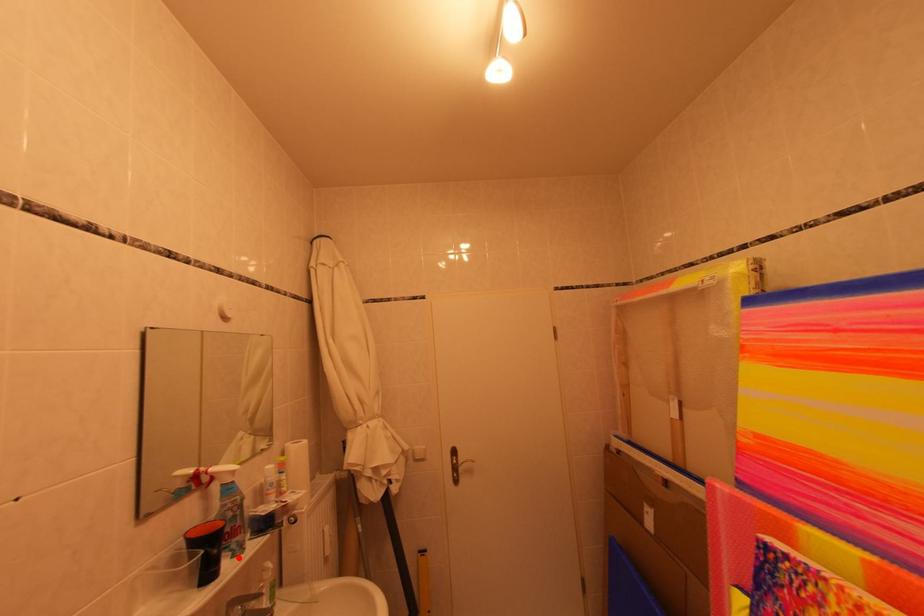
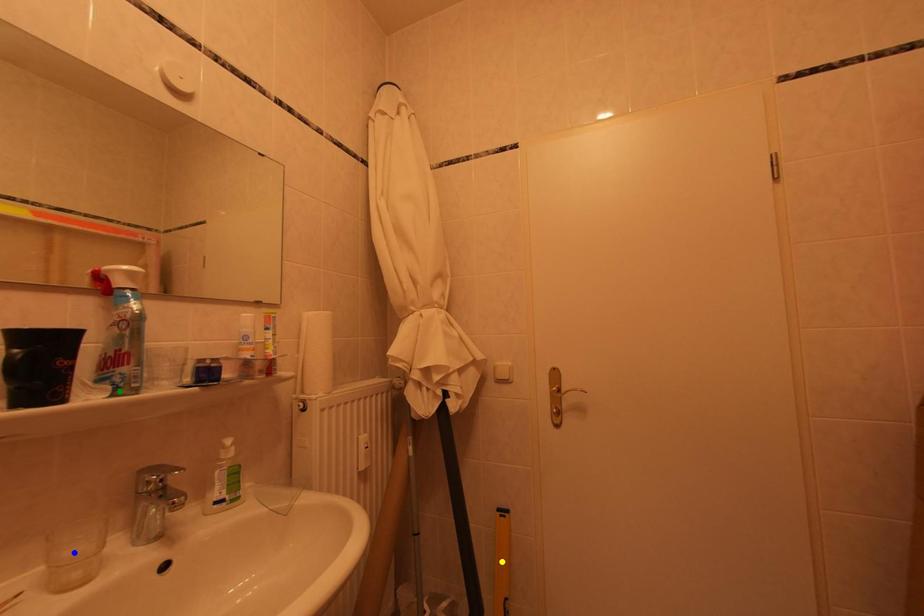
Question: I am providing you with two images of the same scene from different viewpoints. A red point is marked on the first image. You are given multiple points on the second image. Can you choose the point in image 2 that corresponds to the point in image 1?

Choices:
 (A) green point
 (B) yellow point
 (C) blue point

Answer: (A)